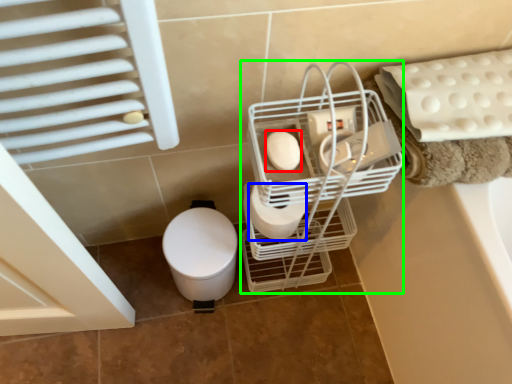
Question: Based on their relative distances, which object is farther from toilet paper (highlighted by a red box)? Choose from toilet paper (highlighted by a blue box) and trolley (highlighted by a green box).

Choices:
 (A) toilet paper
 (B) trolley

Answer: (B)